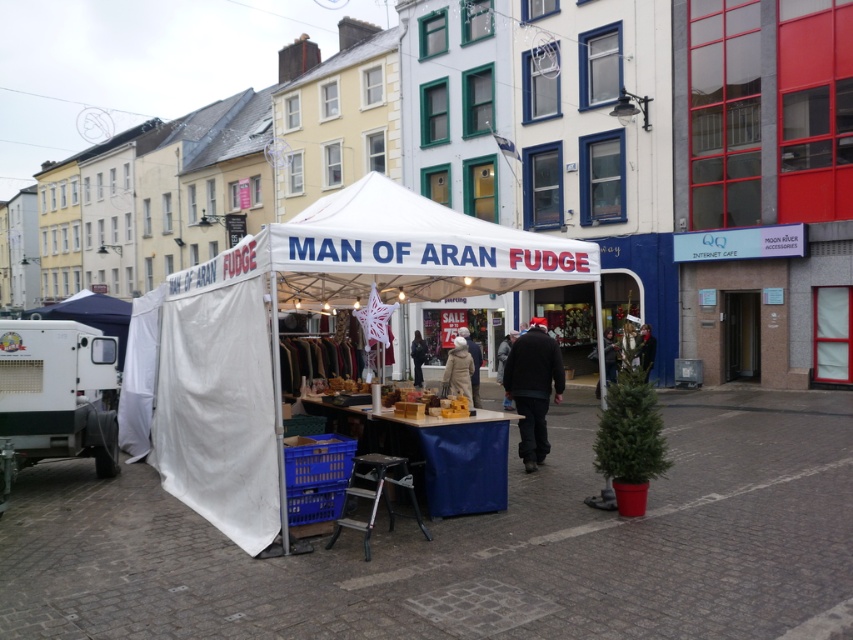
Who is shorter, dark brown leather jacket at center or dark blue jacket at center?

Standing shorter between the two is dark blue jacket at center.

Can you confirm if dark brown leather jacket at center is positioned below dark blue jacket at center?

No, dark brown leather jacket at center is not below dark blue jacket at center.

At what (x,y) coordinates should I click in order to perform the action: click on dark brown leather jacket at center. Please return your answer as a coordinate pair (x, y). Looking at the image, I should click on (532, 388).

Locate an element on the screen. dark brown leather jacket at center is located at coordinates (532, 388).

Can you confirm if white fabric canopy at center is positioned below white woolen hat at center?

No.

Which is more to the left, white fabric canopy at center or white woolen hat at center?

white fabric canopy at center

I want to click on white fabric canopy at center, so click(x=407, y=250).

Does white fabric tent at center have a lesser width compared to metallic silver stool at lower center?

Indeed, white fabric tent at center has a lesser width compared to metallic silver stool at lower center.

Where is `white fabric tent at center`? This screenshot has width=853, height=640. white fabric tent at center is located at coordinates (308, 307).

Find the location of `white fabric tent at center`. white fabric tent at center is located at coordinates (308, 307).